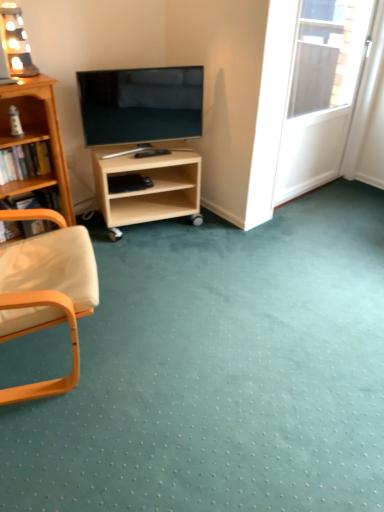
The image size is (384, 512). I want to click on free spot to the right of wooden armchair at left, so pos(174,338).